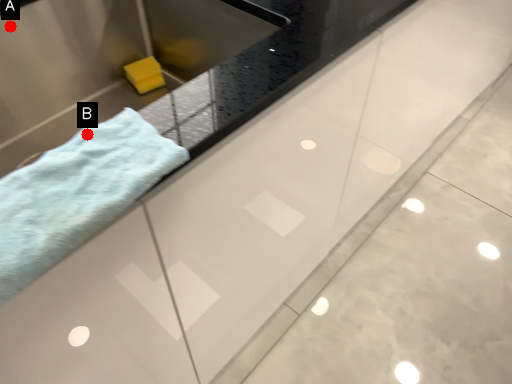
Question: Two points are circled on the image, labeled by A and B beside each circle. Among these points, which one is nearest to the camera?

Choices:
 (A) A is closer
 (B) B is closer

Answer: (B)